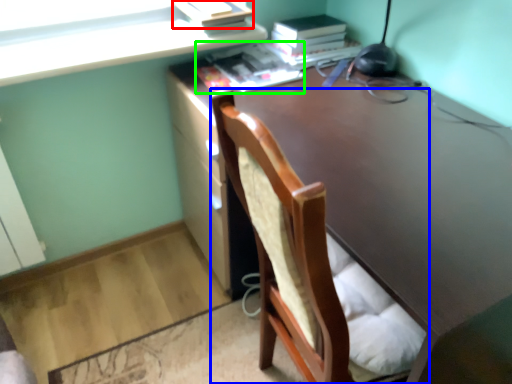
Question: Which is nearer to the paperback book (highlighted by a red box)? chair (highlighted by a blue box) or book (highlighted by a green box).

Choices:
 (A) chair
 (B) book

Answer: (B)